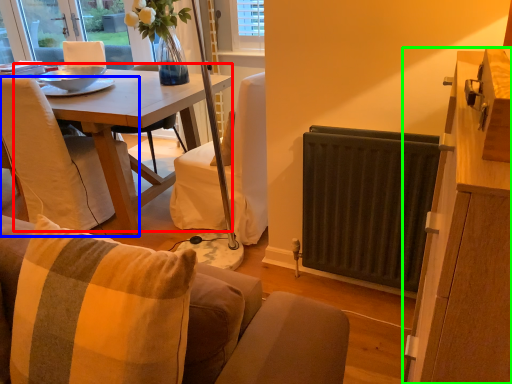
Question: Based on their relative distances, which object is nearer to table (highlighted by a red box)? Choose from chair (highlighted by a blue box) and cabinetry (highlighted by a green box).

Choices:
 (A) chair
 (B) cabinetry

Answer: (A)